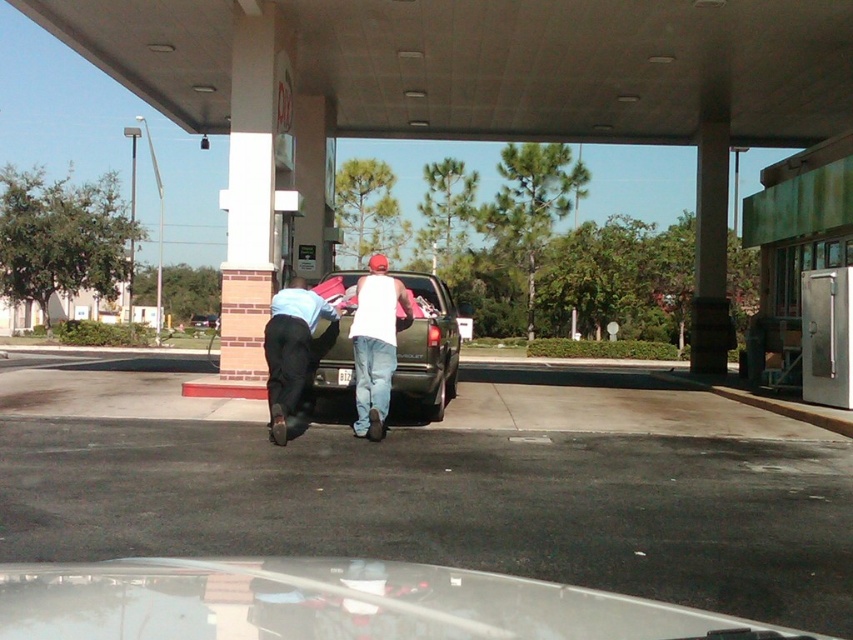
Question: Does white matte tank top at center have a smaller size compared to light blue jeans at lower left?

Choices:
 (A) no
 (B) yes

Answer: (A)

Question: Can you confirm if white matte tank top at center is positioned to the left of light blue jeans at lower left?

Choices:
 (A) no
 (B) yes

Answer: (B)

Question: Which of the following is the closest to the observer?

Choices:
 (A) light blue jeans at lower left
 (B) white matte tank top at center
 (C) metallic green truck at center
 (D) metallic green pickup truck at center

Answer: (D)

Question: Is metallic green pickup truck at center closer to the viewer compared to white matte tank top at center?

Choices:
 (A) yes
 (B) no

Answer: (A)

Question: Which object is the closest to the metallic green truck at center?

Choices:
 (A) white matte tank top at center
 (B) metallic green pickup truck at center

Answer: (A)

Question: Which point appears closest to the camera in this image?

Choices:
 (A) (450, 394)
 (B) (70, 612)
 (C) (374, 317)

Answer: (B)